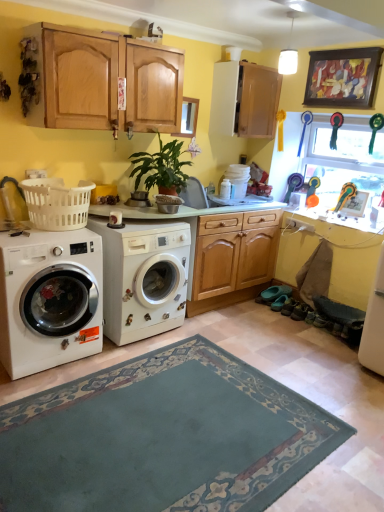
Question: Considering the relative sizes of white matte washing machine at center, positioned as the 2th washing machine in left-to-right order, and white plastic laundry basket at left in the image provided, is white matte washing machine at center, positioned as the 2th washing machine in left-to-right order, bigger than white plastic laundry basket at left?

Choices:
 (A) yes
 (B) no

Answer: (A)

Question: From a real-world perspective, is white matte washing machine at center, positioned as the 2th washing machine in left-to-right order, on white plastic laundry basket at left?

Choices:
 (A) yes
 (B) no

Answer: (B)

Question: Is white matte washing machine at center, marked as the 1th washing machine in a right-to-left arrangement, to the left of white plastic laundry basket at left from the viewer's perspective?

Choices:
 (A) yes
 (B) no

Answer: (B)

Question: Is white matte washing machine at center, marked as the 1th washing machine in a right-to-left arrangement, taller than white plastic laundry basket at left?

Choices:
 (A) yes
 (B) no

Answer: (A)

Question: Does white matte washing machine at center, positioned as the 2th washing machine in left-to-right order, have a lesser height compared to white plastic laundry basket at left?

Choices:
 (A) yes
 (B) no

Answer: (B)

Question: Is green matte plant at center outside white matte washing machine at center, marked as the 1th washing machine in a right-to-left arrangement?

Choices:
 (A) yes
 (B) no

Answer: (A)

Question: From a real-world perspective, is green matte plant at center positioned over white matte washing machine at center, marked as the 1th washing machine in a right-to-left arrangement, based on gravity?

Choices:
 (A) yes
 (B) no

Answer: (A)

Question: Is green matte plant at center turned away from white matte washing machine at center, positioned as the 2th washing machine in left-to-right order?

Choices:
 (A) yes
 (B) no

Answer: (B)

Question: Does green matte plant at center have a greater width compared to white matte washing machine at center, marked as the 1th washing machine in a right-to-left arrangement?

Choices:
 (A) no
 (B) yes

Answer: (A)

Question: Is white matte washing machine at center, marked as the 1th washing machine in a right-to-left arrangement, completely or partially inside green matte plant at center?

Choices:
 (A) no
 (B) yes

Answer: (A)

Question: From a real-world perspective, is green matte plant at center under white matte washing machine at center, marked as the 1th washing machine in a right-to-left arrangement?

Choices:
 (A) yes
 (B) no

Answer: (B)

Question: Considering the relative positions of white matte washing machine at center, positioned as the 2th washing machine in left-to-right order, and white matte washing machine at left, arranged as the second washing machine when viewed from the right, in the image provided, is white matte washing machine at center, positioned as the 2th washing machine in left-to-right order, to the left of white matte washing machine at left, arranged as the second washing machine when viewed from the right, from the viewer's perspective?

Choices:
 (A) no
 (B) yes

Answer: (A)